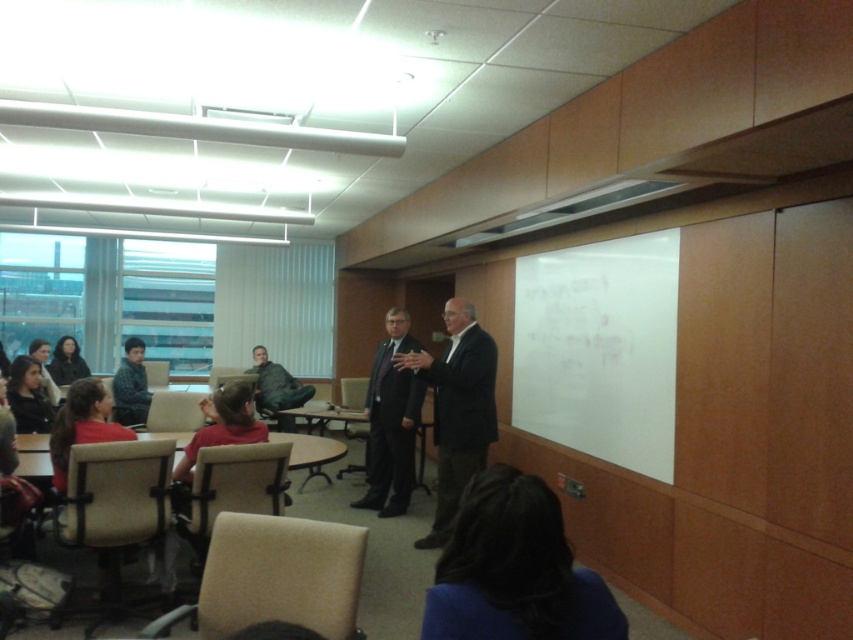
Between point (479, 378) and point (125, 385), which one is positioned behind?

The point (125, 385) is more distant.

Can you confirm if dark suit at center is bigger than camouflage jacket at left?

Yes.

Which is in front, point (482, 387) or point (138, 339)?

Point (482, 387)

I want to click on dark suit at center, so click(457, 410).

Between dark gray fabric jacket at center and camouflage jacket at left, which one is positioned lower?

dark gray fabric jacket at center

Which of these two, dark gray fabric jacket at center or camouflage jacket at left, stands taller?

dark gray fabric jacket at center

Is point (296, 388) farther from camera compared to point (125, 358)?

Yes, it is behind point (125, 358).

Where is `dark gray fabric jacket at center`? The height and width of the screenshot is (640, 853). dark gray fabric jacket at center is located at coordinates (276, 385).

Is dark gray suit at center to the right of dark gray jacket at lower left from the viewer's perspective?

Indeed, dark gray suit at center is positioned on the right side of dark gray jacket at lower left.

Can you confirm if dark gray suit at center is positioned to the left of dark gray jacket at lower left?

No, dark gray suit at center is not to the left of dark gray jacket at lower left.

What do you see at coordinates (392, 420) in the screenshot? The image size is (853, 640). I see `dark gray suit at center` at bounding box center [392, 420].

Where is `dark gray suit at center`? dark gray suit at center is located at coordinates [392, 420].